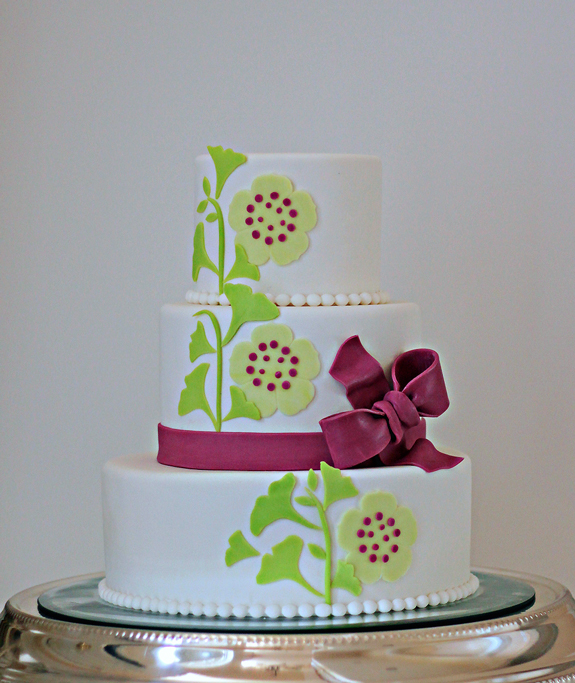
The image size is (575, 683). Identify the location of metal cake plate. (187, 667).